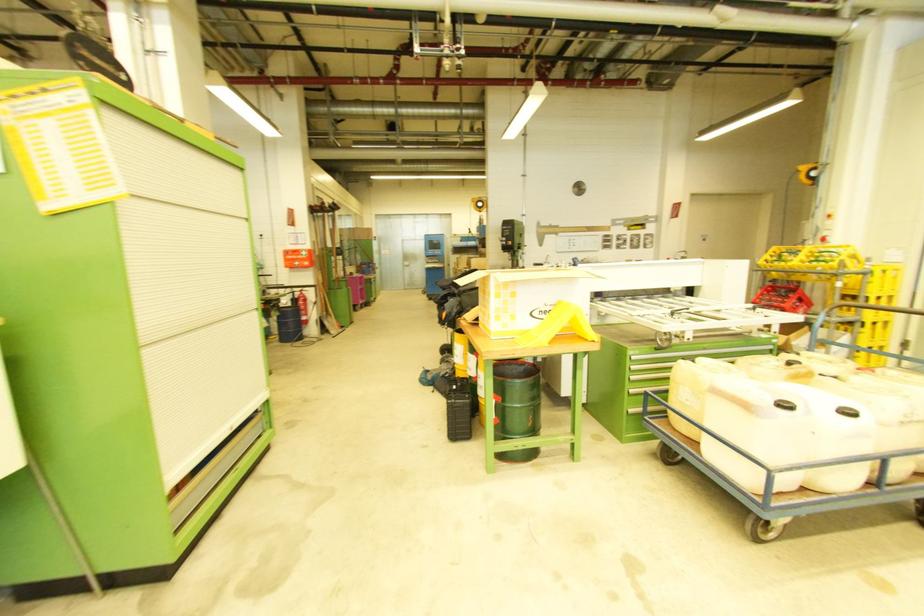
Where would you turn the first aid kit latch? Please return your answer as a coordinate pair (x, y).

(297, 257)